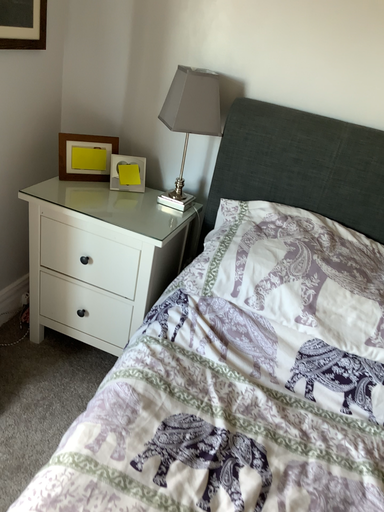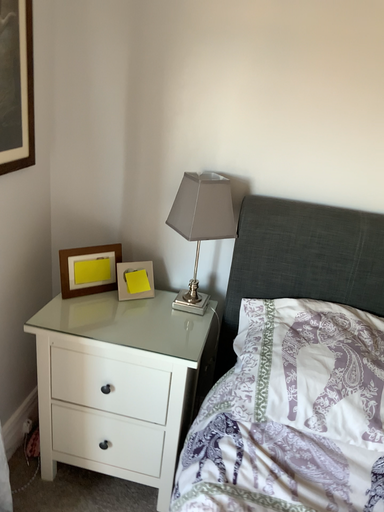
Question: Which way did the camera rotate in the video?

Choices:
 (A) rotated right
 (B) rotated left

Answer: (A)